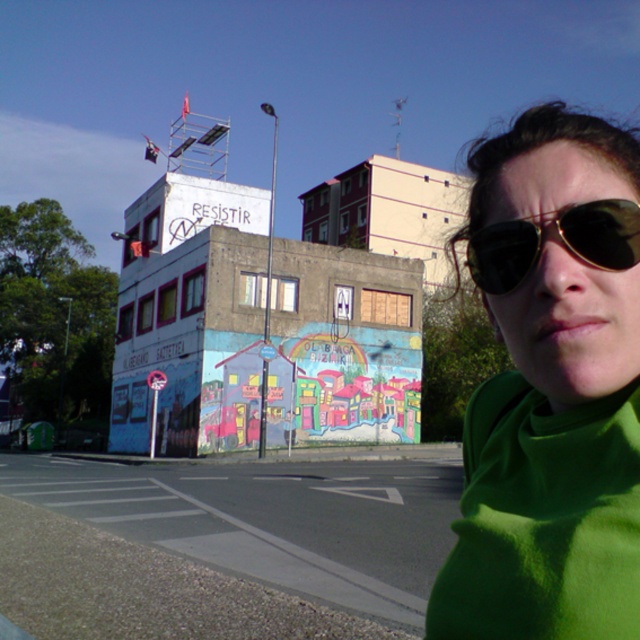
You are a street artist who wants to place a new sticker on the building. You have a green fleece at center and a gold reflective sunglasses at right in your hand. Which object can you use to cover a larger area of the building without overlapping?

The green fleece at center has a larger size compared to the gold reflective sunglasses at right, so it can cover a larger area of the building without overlapping.

You are standing on the sidewalk in front of the building with the colorful mural. You notice a specific point marked at coordinates (552, 388). What object is located at that point?

The point at coordinates (552, 388) indicates the green fleece at center.

You are a pedestrian on the sidewalk and see the green fleece at center and the gold reflective sunglasses at right. Which object is taller?

The green fleece at center is taller than the gold reflective sunglasses at right.